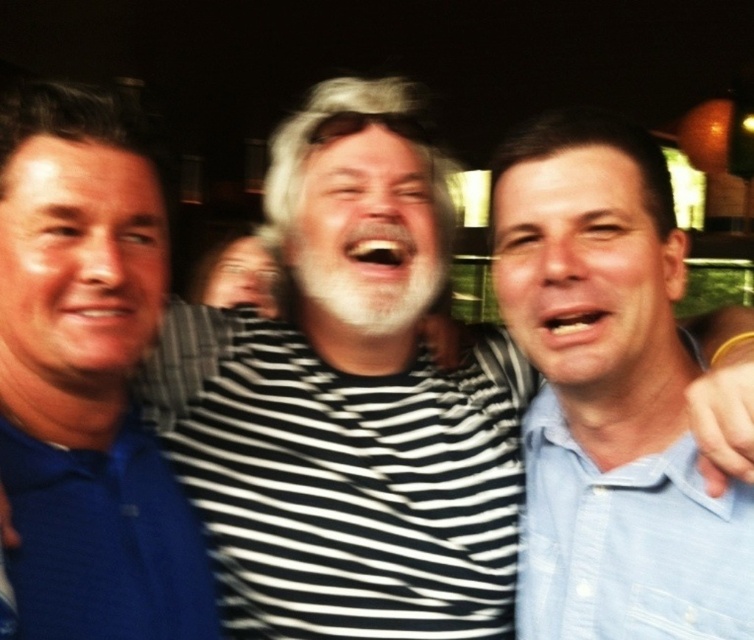
Question: Is light blue shirt at center bigger than light blue cotton shirt at right?

Choices:
 (A) yes
 (B) no

Answer: (A)

Question: Which point is closer to the camera?

Choices:
 (A) click(x=684, y=496)
 (B) click(x=532, y=356)

Answer: (A)

Question: Among these points, which one is farthest from the camera?

Choices:
 (A) (529, 355)
 (B) (604, 547)

Answer: (A)

Question: Can you confirm if light blue shirt at center is positioned to the left of light blue cotton shirt at right?

Choices:
 (A) yes
 (B) no

Answer: (B)

Question: Does light blue shirt at center appear on the right side of light blue cotton shirt at right?

Choices:
 (A) yes
 (B) no

Answer: (A)